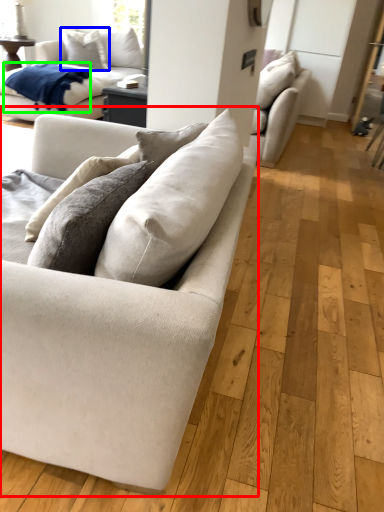
Question: Estimate the real-world distances between objects in this image. Which object is closer to studio couch (highlighted by a red box), pillow (highlighted by a blue box) or blanket (highlighted by a green box)?

Choices:
 (A) pillow
 (B) blanket

Answer: (B)